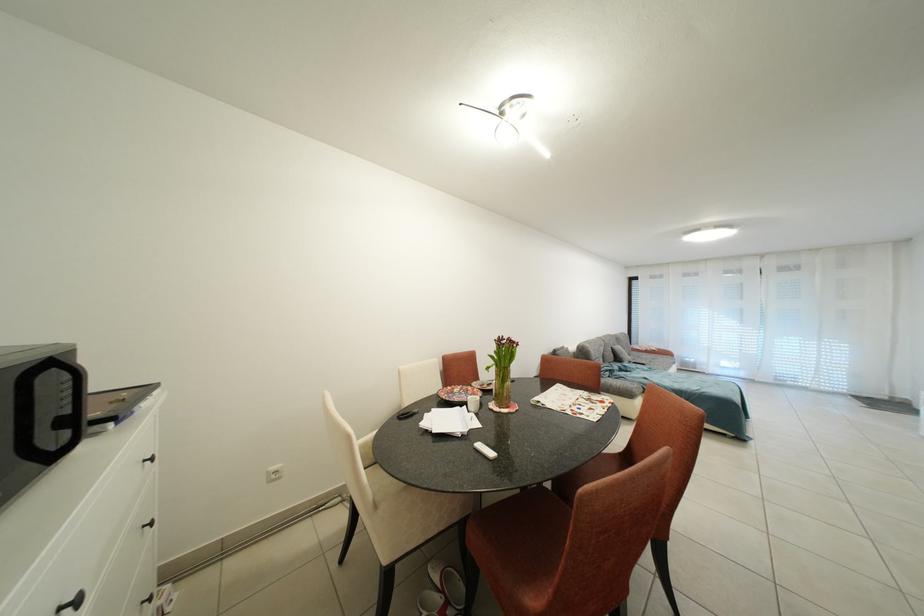
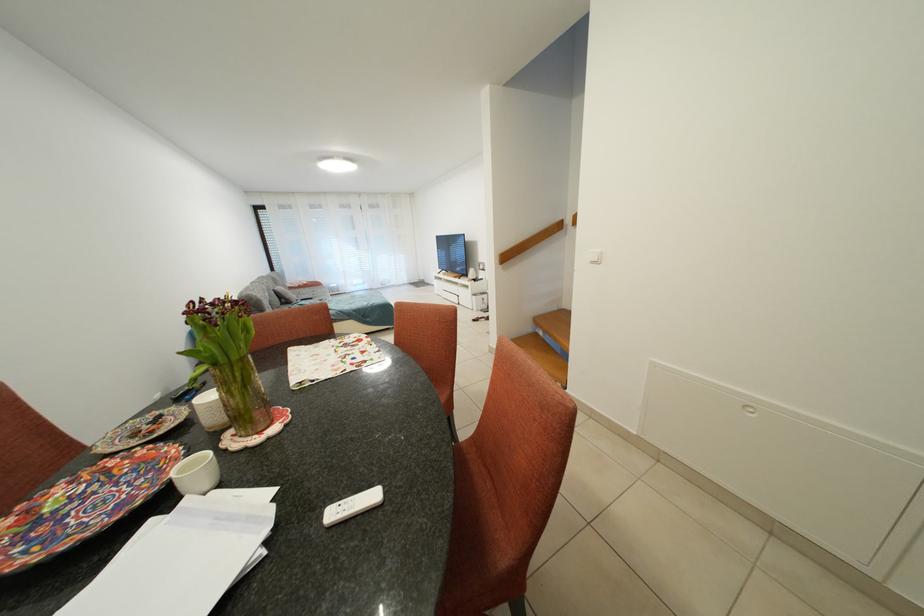
Locate, in the second image, the point that corresponds to point 505,370 in the first image.

(223, 369)